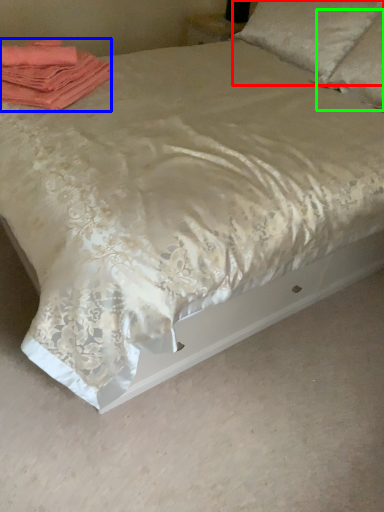
Question: Which object is positioned closest to pillow (highlighted by a red box)? Select from material (highlighted by a blue box) and pillow (highlighted by a green box).

Choices:
 (A) material
 (B) pillow

Answer: (B)